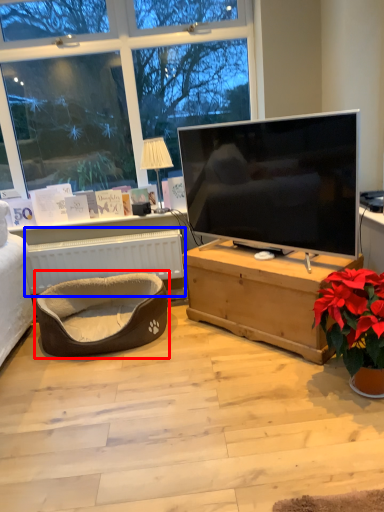
Question: Which object is closer to the camera taking this photo, bean bag chair (highlighted by a red box) or radiator (highlighted by a blue box)?

Choices:
 (A) bean bag chair
 (B) radiator

Answer: (A)